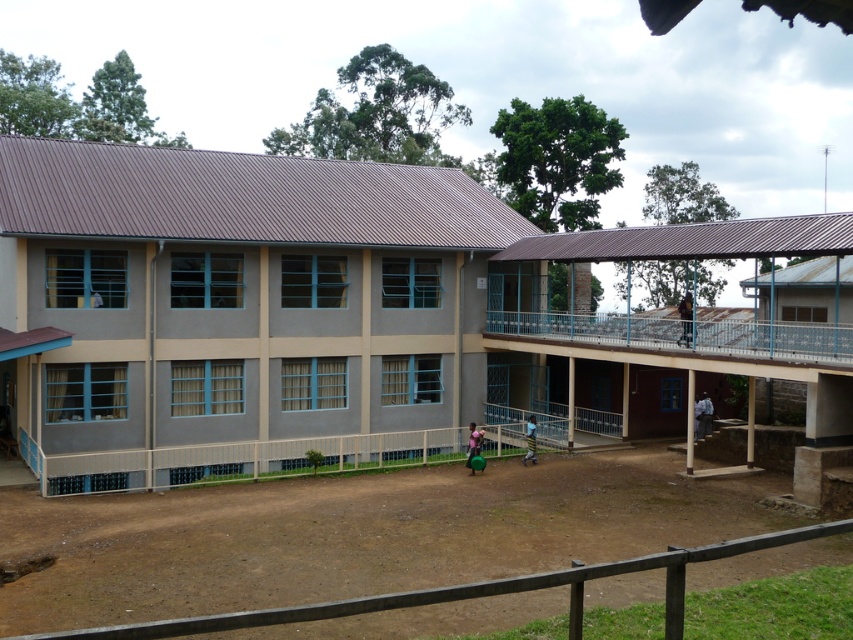
Can you confirm if pink fabric bag at center is shorter than yellow striped skirt at center?

Incorrect, pink fabric bag at center's height does not fall short of yellow striped skirt at center's.

Is pink fabric bag at center to the left of yellow striped skirt at center from the viewer's perspective?

Correct, you'll find pink fabric bag at center to the left of yellow striped skirt at center.

Which is in front, point (474, 429) or point (527, 426)?

Positioned in front is point (474, 429).

Where is `pink fabric bag at center`? pink fabric bag at center is located at coordinates (473, 444).

Between point (700, 417) and point (468, 435), which one is positioned behind?

Point (468, 435)

Can you confirm if blue fabric shirt at lower right is shorter than pink fabric bag at center?

No.

Is point (699, 417) farther from viewer compared to point (471, 422)?

That is True.

Where is `blue fabric shirt at lower right`? The image size is (853, 640). blue fabric shirt at lower right is located at coordinates (703, 417).

Who is more distant from viewer, (706, 410) or (691, 317)?

Positioned behind is point (706, 410).

Is point (706, 433) in front of point (689, 316)?

That is False.

You are a GUI agent. You are given a task and a screenshot of the screen. Output one action in this format:
    pyautogui.click(x=<x>, y=<y>)
    Task: Click on the blue fabric shirt at lower right
    
    Given the screenshot: What is the action you would take?
    pyautogui.click(x=703, y=417)